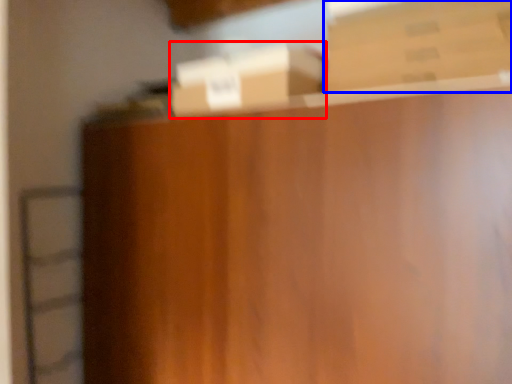
Question: Which object is closer to the camera taking this photo, box (highlighted by a red box) or box (highlighted by a blue box)?

Choices:
 (A) box
 (B) box

Answer: (B)